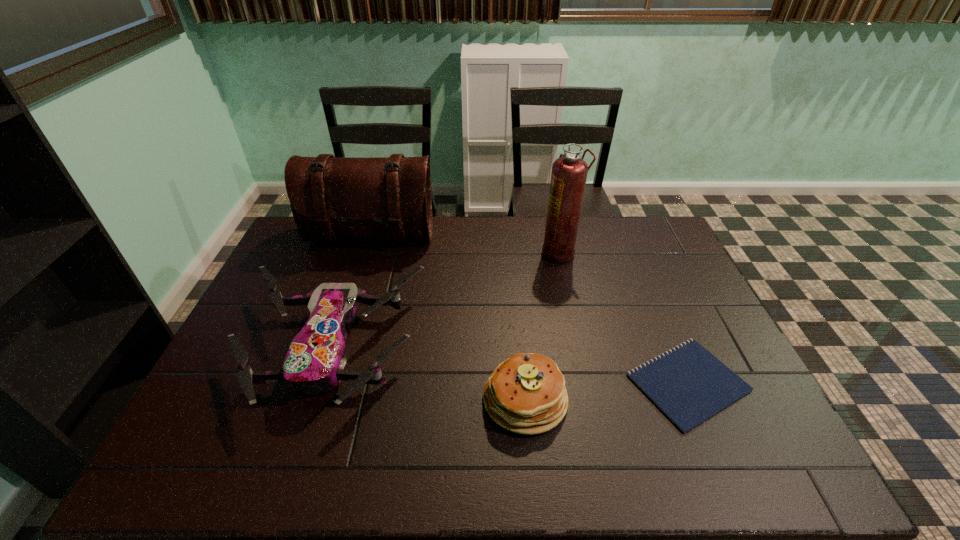
The width and height of the screenshot is (960, 540). I want to click on fire extinguisher, so click(x=569, y=173).

Locate an element on the screen. The width and height of the screenshot is (960, 540). satchel is located at coordinates (332, 198).

The image size is (960, 540). Find the location of `drone`. drone is located at coordinates (314, 363).

Where is `pancake`? pancake is located at coordinates (526, 394).

What are the coordinates of `the rightmost object` in the screenshot? It's located at (688, 384).

Identify the location of the shortest object. (688, 384).

This screenshot has width=960, height=540. Identify the location of vacant area situated 0.220m on the side of the fire extinguisher with the label. (479, 253).

At what (x,y) coordinates should I click in order to perform the action: click on vacant space located on the side of the fire extinguisher with the label. Please return your answer as a coordinate pair (x, y). Looking at the image, I should click on (437, 253).

In order to click on vacant space located on the side of the fire extinguisher with the label in this screenshot , I will do `click(434, 253)`.

This screenshot has width=960, height=540. What are the coordinates of `vacant space located 0.080m on the front-facing side of the second tallest object` in the screenshot? It's located at (361, 272).